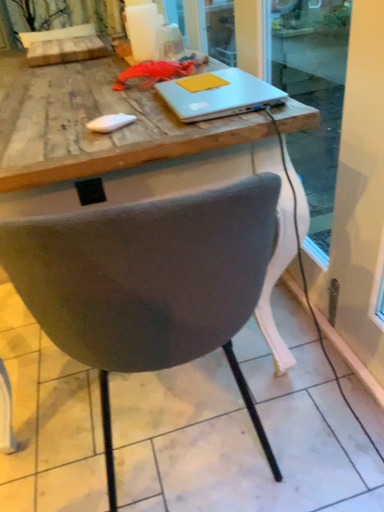
Question: In terms of height, does sleek white laptop at center look taller or shorter compared to yellow matte notepad at upper center?

Choices:
 (A) tall
 (B) short

Answer: (A)

Question: Choose the correct answer: Is sleek white laptop at center inside yellow matte notepad at upper center or outside it?

Choices:
 (A) inside
 (B) outside

Answer: (B)

Question: Which of these objects is positioned closest to the yellow matte notepad at upper center?

Choices:
 (A) white textured curtain at upper left
 (B) sleek white laptop at center
 (C) gray fabric chair at center

Answer: (B)

Question: Which object is the closest to the yellow matte notepad at upper center?

Choices:
 (A) sleek white laptop at center
 (B) white textured curtain at upper left
 (C) gray fabric chair at center

Answer: (A)